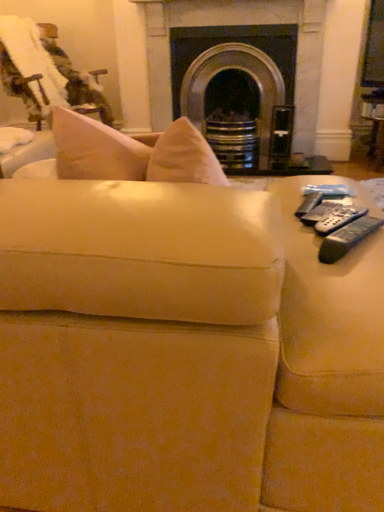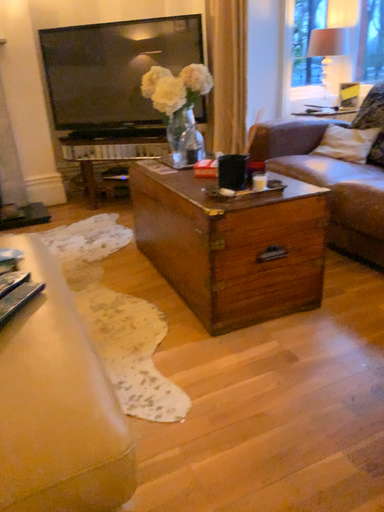
Question: Which way did the camera rotate in the video?

Choices:
 (A) rotated downward
 (B) rotated upward

Answer: (B)